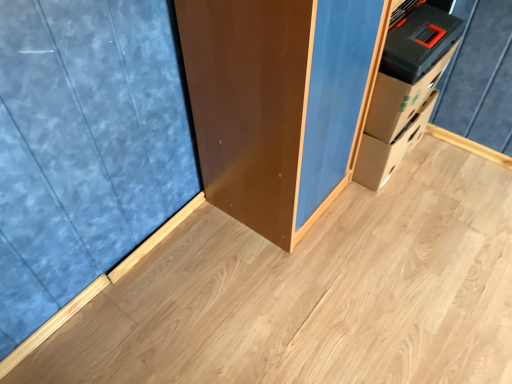
I want to click on blue textured curtain at left, so click(x=83, y=147).

What is the approximate height of blue textured curtain at left?

blue textured curtain at left is 35.20 inches in height.

What do you see at coordinates (83, 147) in the screenshot? The width and height of the screenshot is (512, 384). I see `blue textured curtain at left` at bounding box center [83, 147].

Image resolution: width=512 pixels, height=384 pixels. Describe the element at coordinates (315, 293) in the screenshot. I see `natural wood plywood at center` at that location.

In order to face natural wood plywood at center, should I rotate leftwards or rightwards?

It's best to rotate right around 10.547 degrees.

Locate an element on the screen. natural wood plywood at center is located at coordinates (315, 293).

Find the location of a particular element. This screenshot has width=512, height=384. blue textured curtain at left is located at coordinates (83, 147).

Is natural wood plywood at center at the left side of blue textured curtain at left?

In fact, natural wood plywood at center is to the right of blue textured curtain at left.

Between natural wood plywood at center and blue textured curtain at left, which one is positioned behind?

natural wood plywood at center is further away from the camera.

Does point (426, 258) come closer to viewer compared to point (41, 227)?

No, it is behind (41, 227).

From the picture: From the image's perspective, is natural wood plywood at center on blue textured curtain at left?

Actually, natural wood plywood at center appears below blue textured curtain at left in the image.

From a real-world perspective, is natural wood plywood at center below blue textured curtain at left?

Yes, from a real-world perspective, natural wood plywood at center is under blue textured curtain at left.

Considering the sizes of natural wood plywood at center and blue textured curtain at left in the image, is natural wood plywood at center wider or thinner than blue textured curtain at left?

In the image, natural wood plywood at center appears to be wider than blue textured curtain at left.

Which of these two, natural wood plywood at center or blue textured curtain at left, stands taller?

blue textured curtain at left is taller.

Looking at the image, does natural wood plywood at center seem bigger or smaller compared to blue textured curtain at left?

In the image, natural wood plywood at center appears to be larger than blue textured curtain at left.

Is natural wood plywood at center completely or partially outside of blue textured curtain at left?

natural wood plywood at center lies outside blue textured curtain at left's area.

Is natural wood plywood at center not near blue textured curtain at left?

No, there isn't a large distance between natural wood plywood at center and blue textured curtain at left.

Is natural wood plywood at center facing towards blue textured curtain at left?

No, natural wood plywood at center is not turned towards blue textured curtain at left.

How many degrees apart are the facing directions of natural wood plywood at center and blue textured curtain at left?

180 degrees separate the facing orientations of natural wood plywood at center and blue textured curtain at left.

Measure the distance from natural wood plywood at center to blue textured curtain at left.

natural wood plywood at center and blue textured curtain at left are 52.75 centimeters apart from each other.

This screenshot has height=384, width=512. I want to click on plywood located behind the blue textured curtain at left, so click(x=315, y=293).

Which is more to the right, blue textured curtain at left or natural wood plywood at center?

From the viewer's perspective, natural wood plywood at center appears more on the right side.

Between blue textured curtain at left and natural wood plywood at center, which one is positioned behind?

natural wood plywood at center.

Considering the positions of point (82, 239) and point (448, 150), is point (82, 239) closer or farther from the camera than point (448, 150)?

Point (82, 239) appears to be closer to the viewer than point (448, 150).

From the image's perspective, would you say blue textured curtain at left is shown under natural wood plywood at center?

No.

From a real-world perspective, is blue textured curtain at left on natural wood plywood at center?

Yes, from a real-world perspective, blue textured curtain at left is on top of natural wood plywood at center.

Which object is wider, blue textured curtain at left or natural wood plywood at center?

With larger width is natural wood plywood at center.

Considering the sizes of objects blue textured curtain at left and natural wood plywood at center in the image provided, who is taller, blue textured curtain at left or natural wood plywood at center?

With more height is blue textured curtain at left.

Considering the sizes of objects blue textured curtain at left and natural wood plywood at center in the image provided, who is bigger, blue textured curtain at left or natural wood plywood at center?

natural wood plywood at center is bigger.

Is blue textured curtain at left not inside natural wood plywood at center?

Yes.

Is blue textured curtain at left not near natural wood plywood at center?

No, blue textured curtain at left is in close proximity to natural wood plywood at center.

Is blue textured curtain at left facing away from natural wood plywood at center?

No, blue textured curtain at left's orientation is not away from natural wood plywood at center.

How many degrees apart are the facing directions of blue textured curtain at left and natural wood plywood at center?

The facing directions of blue textured curtain at left and natural wood plywood at center are 180 degrees apart.

Where is `plywood on the right of the blue textured curtain at left`? plywood on the right of the blue textured curtain at left is located at coordinates click(x=315, y=293).

Where is `plywood located below the blue textured curtain at left (from the image's perspective)`? plywood located below the blue textured curtain at left (from the image's perspective) is located at coordinates (315, 293).

I want to click on plywood behind the blue textured curtain at left, so click(x=315, y=293).